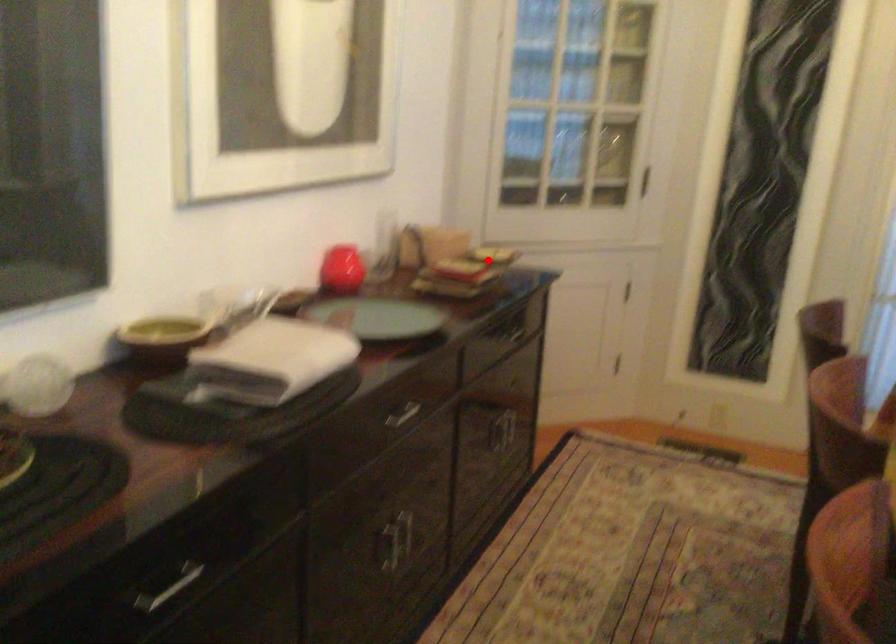
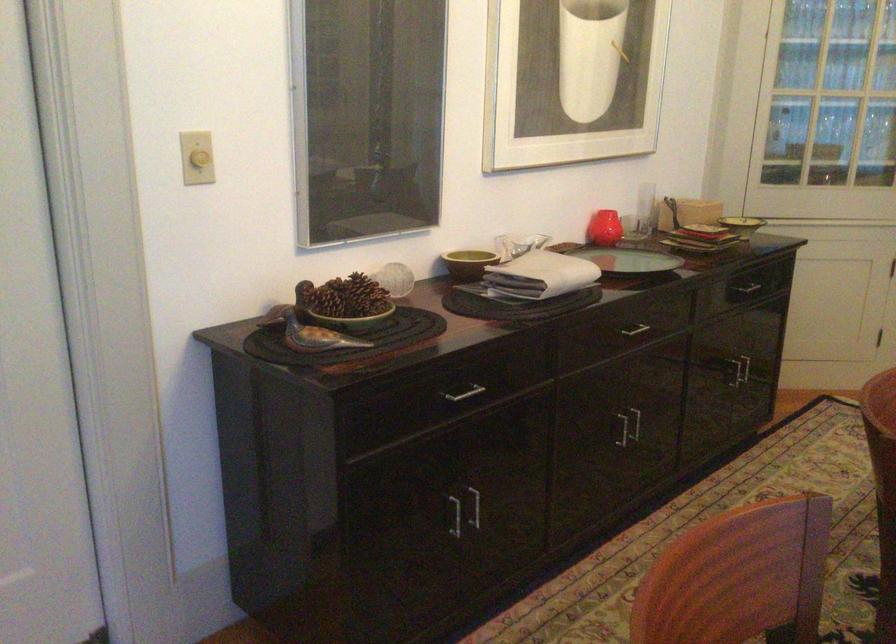
The point at the highlighted location is marked in the first image. Where is the corresponding point in the second image?

(742, 225)